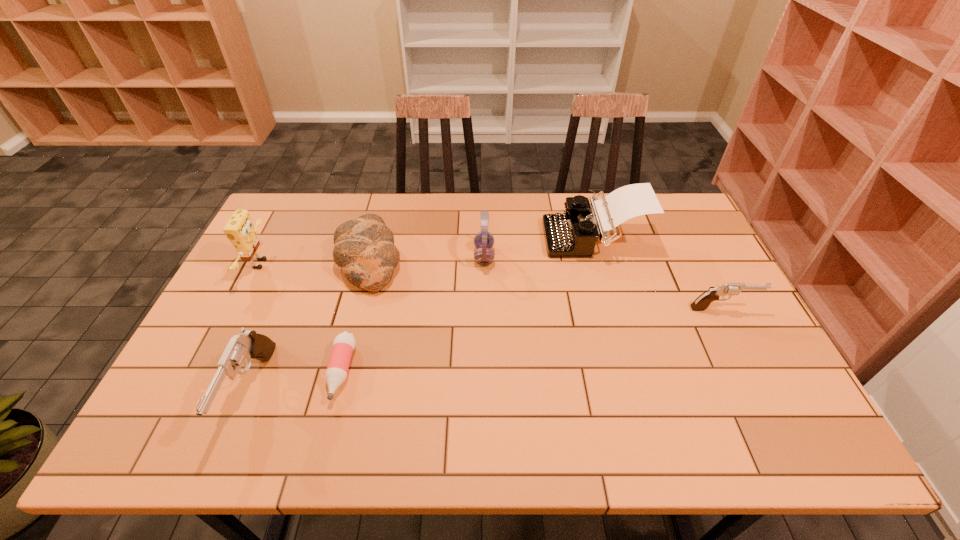
The height and width of the screenshot is (540, 960). I want to click on free area in between the rightmost object and the typewriter, so click(659, 273).

At what (x,y) coordinates should I click in order to perform the action: click on free space between the shortest object and the third nearest object. Please return your answer as a coordinate pair (x, y). This screenshot has width=960, height=540. Looking at the image, I should click on (532, 340).

Find the location of a particular element. vacant space that is in between the left gun and the sponge is located at coordinates (256, 327).

The width and height of the screenshot is (960, 540). What are the coordinates of `vacant point located between the bottle and the left gun` in the screenshot? It's located at (297, 381).

This screenshot has width=960, height=540. What are the coordinates of `object that is the fourth closest to the headset` in the screenshot? It's located at (701, 303).

Find the location of a particular element. object that is the closest to the taller gun is located at coordinates (343, 345).

Where is `vacant space that satisfies the following two spatial constraints: 1. at the muzzle of the right gun; 2. at the muzzle of the left gun`? vacant space that satisfies the following two spatial constraints: 1. at the muzzle of the right gun; 2. at the muzzle of the left gun is located at coordinates (765, 391).

I want to click on free space that satisfies the following two spatial constraints: 1. on the headband and ear cups of the third object from right to left; 2. at the muzzle of the taller gun, so click(486, 391).

Find the location of a particular element. Image resolution: width=960 pixels, height=540 pixels. free region that satisfies the following two spatial constraints: 1. at the muzzle of the right gun; 2. with the cap open on the shortest object is located at coordinates (756, 372).